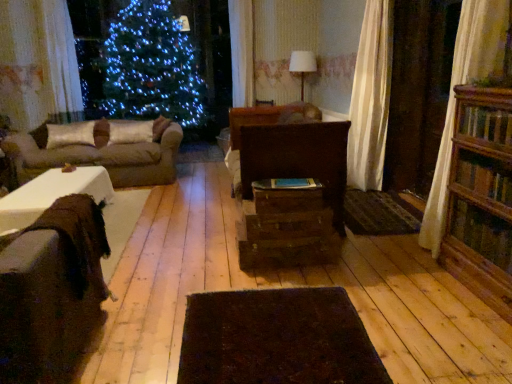
Identify the location of vacant space that is to the left of wooden bookcase at right. (411, 292).